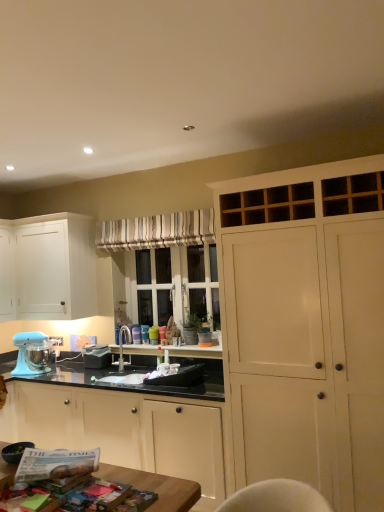
Question: Is satin nickel faucet at center at the left side of matte white cabinet at center, the 2th cabinetry from the left?

Choices:
 (A) no
 (B) yes

Answer: (B)

Question: Is satin nickel faucet at center taller than matte white cabinet at center, which is counted as the second cabinetry, starting from the right?

Choices:
 (A) no
 (B) yes

Answer: (A)

Question: Is there a large distance between satin nickel faucet at center and matte white cabinet at center, which is counted as the second cabinetry, starting from the right?

Choices:
 (A) yes
 (B) no

Answer: (B)

Question: Considering the relative positions of satin nickel faucet at center and matte white cabinet at center, the 2th cabinetry from the left, in the image provided, is satin nickel faucet at center in front of matte white cabinet at center, the 2th cabinetry from the left,?

Choices:
 (A) yes
 (B) no

Answer: (B)

Question: Is satin nickel faucet at center positioned behind matte white cabinet at center, which is counted as the second cabinetry, starting from the right?

Choices:
 (A) no
 (B) yes

Answer: (B)

Question: Based on their positions, is matte blue mixer at lower left located to the left or right of striped fabric curtain at center?

Choices:
 (A) right
 (B) left

Answer: (B)

Question: From the image's perspective, relative to striped fabric curtain at center, is matte blue mixer at lower left above or below?

Choices:
 (A) below
 (B) above

Answer: (A)

Question: From a real-world perspective, is matte blue mixer at lower left positioned above or below striped fabric curtain at center?

Choices:
 (A) below
 (B) above

Answer: (A)

Question: Is matte blue mixer at lower left taller or shorter than striped fabric curtain at center?

Choices:
 (A) tall
 (B) short

Answer: (A)

Question: From a real-world perspective, is matte blue mixer at lower left physically located above or below white matte cabinet at left, which is counted as the 3th cabinetry, starting from the right?

Choices:
 (A) below
 (B) above

Answer: (A)

Question: From the image's perspective, is matte blue mixer at lower left located above or below white matte cabinet at left, which is counted as the 3th cabinetry, starting from the right?

Choices:
 (A) above
 (B) below

Answer: (B)

Question: Would you say matte blue mixer at lower left is inside or outside white matte cabinet at left, which is counted as the 3th cabinetry, starting from the right?

Choices:
 (A) outside
 (B) inside

Answer: (A)

Question: In terms of height, does matte blue mixer at lower left look taller or shorter compared to white matte cabinet at left, acting as the 1th cabinetry starting from the left?

Choices:
 (A) short
 (B) tall

Answer: (A)

Question: Based on their sizes in the image, would you say satin nickel faucet at center is bigger or smaller than white matte cabinet at left, acting as the 1th cabinetry starting from the left?

Choices:
 (A) small
 (B) big

Answer: (A)

Question: Is satin nickel faucet at center wider or thinner than white matte cabinet at left, acting as the 1th cabinetry starting from the left?

Choices:
 (A) thin
 (B) wide

Answer: (A)